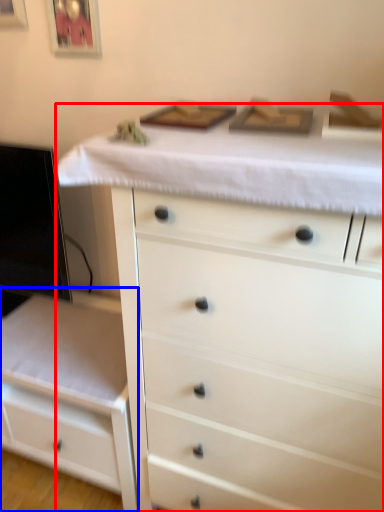
Question: Among these objects, which one is nearest to the camera, chest of drawers (highlighted by a red box) or chest of drawers (highlighted by a blue box)?

Choices:
 (A) chest of drawers
 (B) chest of drawers

Answer: (A)